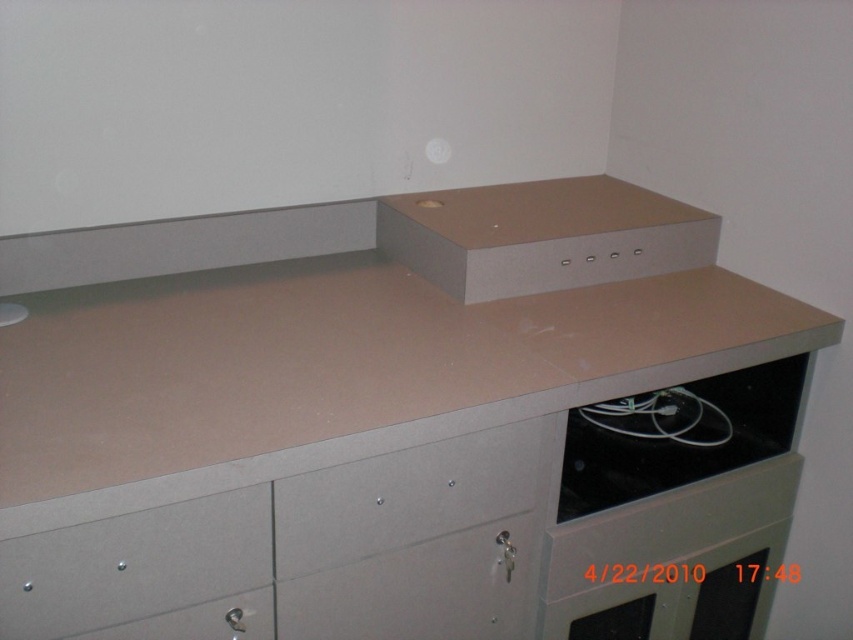
In the scene shown: You are organizing your office and need to place a large box that requires a spacious drawer. You see the metallic gray drawer at lower center and the metallic gray drawer at lower left. Which drawer should you choose?

The metallic gray drawer at lower center is larger in size than the metallic gray drawer at lower left, so you should choose the metallic gray drawer at lower center to place the large box.

You are organizing the workspace and need to access the metallic gray drawer at lower center. However, there is a black matte cable at lower right in the way. Can you move the cable to access the drawer?

The metallic gray drawer at lower center is positioned under the black matte cable at lower right, so you can move the cable to the side to access the drawer.

You are organizing cables in an office space and need to place a black matte cable at lower right near the metallic gray drawer at lower center. Given the space between them is 13.78 inches, will the cable fit comfortably without bending too much?

The distance between the metallic gray drawer at lower center and the black matte cable at lower right is 13.78 inches. Since this space is sufficient for a standard cable length, the cable can be placed comfortably without excessive bending.